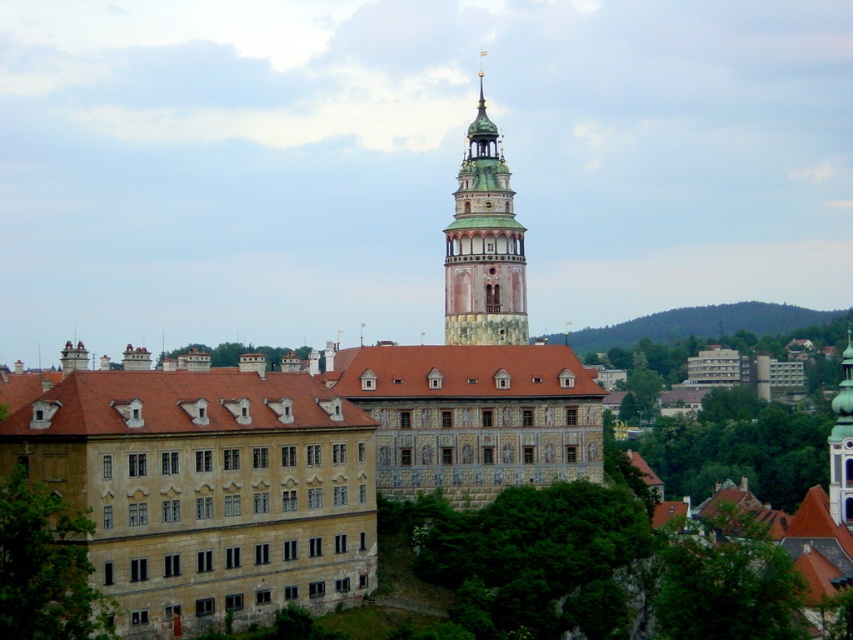
Who is shorter, brown stone building at center or green wooden bell tower at center?

With less height is brown stone building at center.

Between point (194, 385) and point (469, 168), which one is positioned in front?

Positioned in front is point (194, 385).

At what (x,y) coordinates should I click in order to perform the action: click on brown stone building at center. Please return your answer as a coordinate pair (x, y). Image resolution: width=853 pixels, height=640 pixels. Looking at the image, I should click on (286, 465).

Can you confirm if green wooden bell tower at center is bigger than green grassy hillside at upper right?

Yes.

Between green wooden bell tower at center and green grassy hillside at upper right, which one has more height?

Standing taller between the two is green wooden bell tower at center.

The width and height of the screenshot is (853, 640). Find the location of `green wooden bell tower at center`. green wooden bell tower at center is located at coordinates (485, 246).

Image resolution: width=853 pixels, height=640 pixels. Describe the element at coordinates (286, 465) in the screenshot. I see `brown stone building at center` at that location.

Between point (165, 625) and point (728, 324), which one is positioned in front?

Point (165, 625)

At what (x,y) coordinates should I click in order to perform the action: click on brown stone building at center. Please return your answer as a coordinate pair (x, y). The height and width of the screenshot is (640, 853). Looking at the image, I should click on (286, 465).